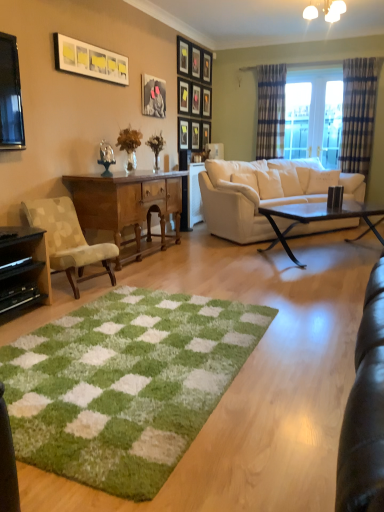
Question: Is plaid fabric curtain at right, which is the second curtain in left-to-right order, positioned with its back to plaid fabric curtain at right, the first curtain positioned from the left?

Choices:
 (A) yes
 (B) no

Answer: (B)

Question: Does plaid fabric curtain at right, the first curtain in the right-to-left sequence, appear on the right side of plaid fabric curtain at right, the 2th curtain when ordered from right to left?

Choices:
 (A) no
 (B) yes

Answer: (B)

Question: From the image's perspective, is plaid fabric curtain at right, which is the second curtain in left-to-right order, under plaid fabric curtain at right, the first curtain positioned from the left?

Choices:
 (A) no
 (B) yes

Answer: (B)

Question: From a real-world perspective, does plaid fabric curtain at right, the first curtain in the right-to-left sequence, sit lower than plaid fabric curtain at right, the 2th curtain when ordered from right to left?

Choices:
 (A) yes
 (B) no

Answer: (A)

Question: Is plaid fabric curtain at right, which is the second curtain in left-to-right order, outside plaid fabric curtain at right, the 2th curtain when ordered from right to left?

Choices:
 (A) yes
 (B) no

Answer: (A)

Question: Is plaid fabric curtain at right, the 2th curtain when ordered from right to left, surrounded by plaid fabric curtain at right, which is the second curtain in left-to-right order?

Choices:
 (A) no
 (B) yes

Answer: (A)

Question: Considering the relative positions of white glossy picture frame at upper left, which is the eleventh picture frame from back to front, and wooden picture frame at upper center, which is the 10th picture frame in front-to-back order, in the image provided, is white glossy picture frame at upper left, which is the eleventh picture frame from back to front, to the right of wooden picture frame at upper center, which is the 10th picture frame in front-to-back order, from the viewer's perspective?

Choices:
 (A) no
 (B) yes

Answer: (A)

Question: Is wooden picture frame at upper center, which is the 10th picture frame in front-to-back order, at the back of white glossy picture frame at upper left, which ranks as the 1th picture frame in front-to-back order?

Choices:
 (A) yes
 (B) no

Answer: (B)

Question: From the image's perspective, is white glossy picture frame at upper left, which ranks as the 1th picture frame in front-to-back order, on top of wooden picture frame at upper center, arranged as the 2th picture frame when viewed from the back?

Choices:
 (A) yes
 (B) no

Answer: (B)

Question: Is white glossy picture frame at upper left, which ranks as the 1th picture frame in front-to-back order, with wooden picture frame at upper center, arranged as the 2th picture frame when viewed from the back?

Choices:
 (A) yes
 (B) no

Answer: (B)

Question: Would you say white glossy picture frame at upper left, which is the eleventh picture frame from back to front, is a long distance from wooden picture frame at upper center, which is the 10th picture frame in front-to-back order?

Choices:
 (A) yes
 (B) no

Answer: (A)

Question: Could you tell me if white glossy picture frame at upper left, which is the eleventh picture frame from back to front, is turned towards wooden picture frame at upper center, arranged as the 2th picture frame when viewed from the back?

Choices:
 (A) yes
 (B) no

Answer: (B)

Question: From a real-world perspective, is beige fabric chair at left positioned over matte black picture frame at upper center, which is the third picture frame in back-to-front order, based on gravity?

Choices:
 (A) no
 (B) yes

Answer: (A)